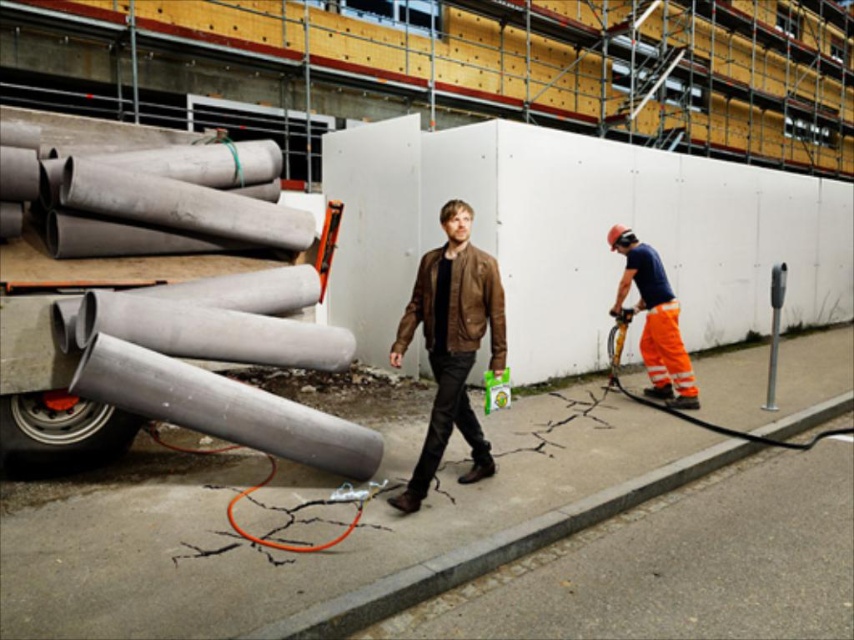
You are a safety inspector observing the construction site. You notice two workers wearing different protective gear. The first worker is wearing a brown leather jacket at center, and the second worker has orange reflective pants at right. According to safety protocols, which worker is positioned in a safer location relative to potential falling objects from the truck?

The orange reflective pants at right is positioned above the brown leather jacket at center, so the worker in orange reflective pants at right is in a safer location as they are less likely to be hit by falling objects from the truck.

You are a construction worker trying to locate the brown leather jacket at center. Based on the coordinates provided in the scene description, can you determine its position relative to the truck loaded with cylindrical concrete pipes?

The brown leather jacket at center is located at coordinates point (x=452, y=344), which places it near the center of the scene. Since the truck is in the foreground, the jacket is likely positioned to the side or behind the truck, but the exact spatial relationship requires checking the coordinates against the truck position.